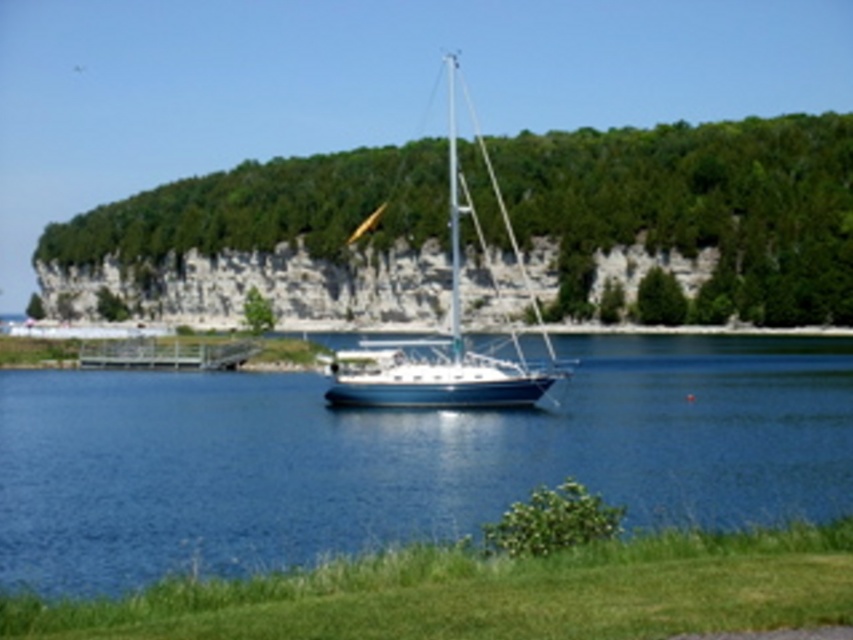
Question: Is blue glossy water at center smaller than blue glossy sailboat at center?

Choices:
 (A) yes
 (B) no

Answer: (A)

Question: Is blue glossy water at center further to camera compared to blue glossy sailboat at center?

Choices:
 (A) no
 (B) yes

Answer: (A)

Question: Can you confirm if blue glossy water at center is positioned below blue glossy sailboat at center?

Choices:
 (A) yes
 (B) no

Answer: (A)

Question: Which point is farther to the camera?

Choices:
 (A) pos(532,481)
 (B) pos(433,381)
 (C) pos(253,340)

Answer: (C)

Question: Which point appears closest to the camera in this image?

Choices:
 (A) (450, 195)
 (B) (670, 449)

Answer: (B)

Question: Which point is closer to the camera taking this photo?

Choices:
 (A) (376, 529)
 (B) (381, 356)

Answer: (A)